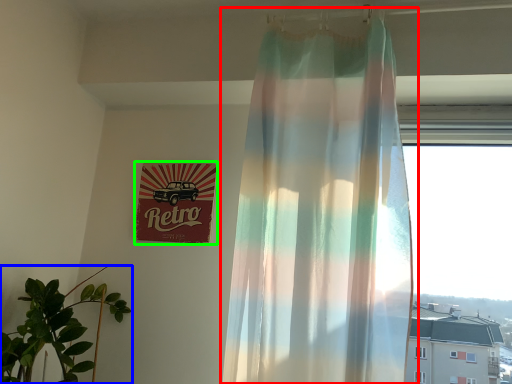
Question: Estimate the real-world distances between objects in this image. Which object is closer to curtain (highlighted by a red box), houseplant (highlighted by a blue box) or signage (highlighted by a green box)?

Choices:
 (A) houseplant
 (B) signage

Answer: (B)